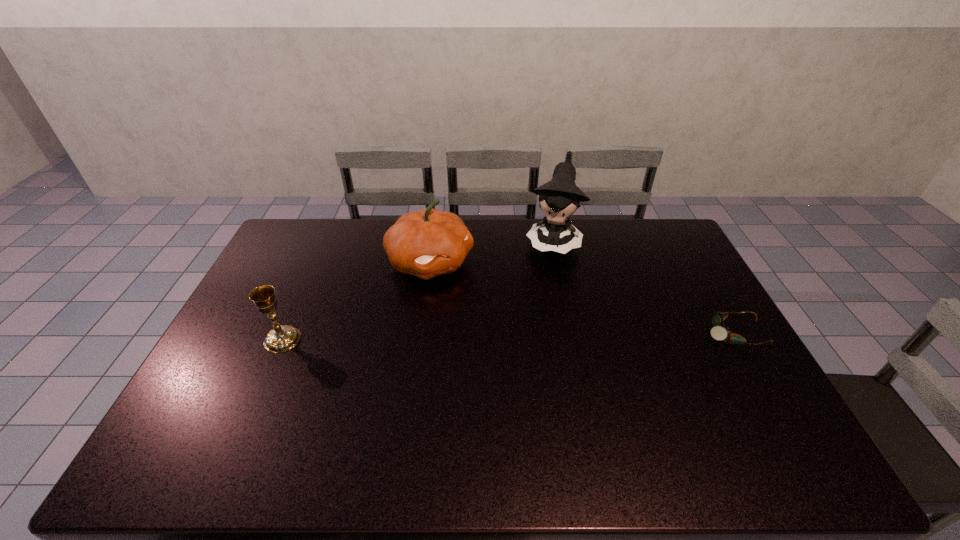
You are a GUI agent. You are given a task and a screenshot of the screen. Output one action in this format:
    pyautogui.click(x=<x>, y=<y>)
    Task: Click on the vacant region between the doll and the third tallest object
    
    Given the screenshot: What is the action you would take?
    pyautogui.click(x=418, y=290)

You are a GUI agent. You are given a task and a screenshot of the screen. Output one action in this format:
    pyautogui.click(x=<x>, y=<y>)
    Task: Click on the free space between the rightmost object and the third shortest object
    Image resolution: width=960 pixels, height=540 pixels.
    Given the screenshot: What is the action you would take?
    pyautogui.click(x=582, y=298)

Find the location of a particular element. This screenshot has width=960, height=540. free spot between the third object from right to left and the spectacles is located at coordinates click(582, 298).

Identify the location of vacant space that's between the chalice and the rightmost object. Image resolution: width=960 pixels, height=540 pixels. (508, 336).

The width and height of the screenshot is (960, 540). In order to click on the closest object to the tallest object in this screenshot , I will do `click(428, 243)`.

Locate which object ranks third in proximity to the second shortest object. Please provide its 2D coordinates. Your answer should be formatted as a tuple, i.e. [(x, y)], where the tuple contains the x and y coordinates of a point satisfying the conditions above.

[(719, 333)]

Image resolution: width=960 pixels, height=540 pixels. What are the coordinates of `vacant region that satisfies the following two spatial constraints: 1. on the back side of the third tallest object; 2. on the left side of the second object from right to left` in the screenshot? It's located at (326, 241).

The width and height of the screenshot is (960, 540). Identify the location of free point that satisfies the following two spatial constraints: 1. on the back side of the leftmost object; 2. on the right side of the doll. (326, 241).

Image resolution: width=960 pixels, height=540 pixels. Identify the location of vacant position in the image that satisfies the following two spatial constraints: 1. on the back side of the third object from left to right; 2. on the right side of the third object from right to left. [x=433, y=241].

Find the location of `vacant space that satisfies the following two spatial constraints: 1. on the front side of the shortest object; 2. on the front-facing side of the third object from left to right`. vacant space that satisfies the following two spatial constraints: 1. on the front side of the shortest object; 2. on the front-facing side of the third object from left to right is located at coordinates (571, 333).